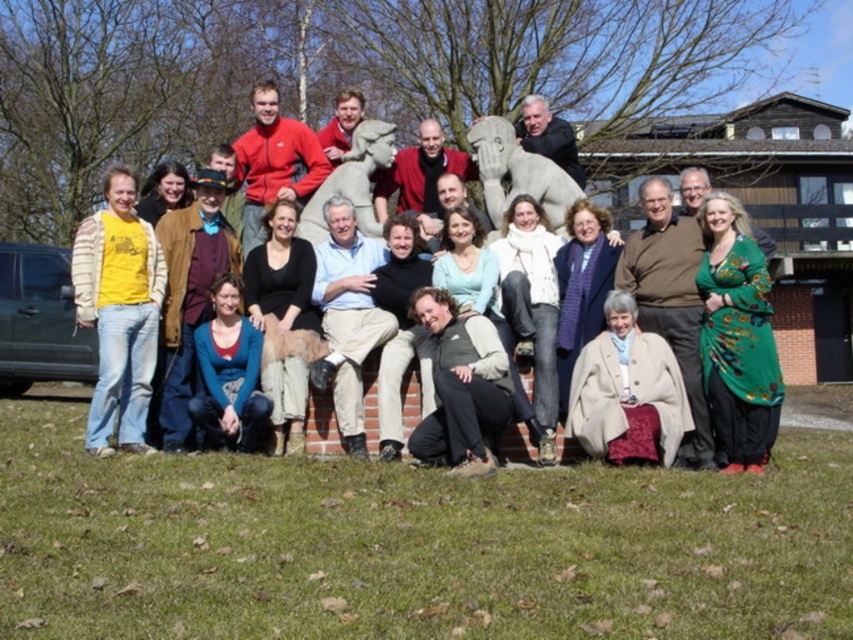
Question: Among these points, which one is nearest to the camera?

Choices:
 (A) (474, 148)
 (B) (741, 256)

Answer: (B)

Question: Does yellow striped sweater at left appear on the left side of matte red jacket at center?

Choices:
 (A) no
 (B) yes

Answer: (B)

Question: Does matte red jacket at center have a greater width compared to stone statue at center?

Choices:
 (A) no
 (B) yes

Answer: (B)

Question: Considering the real-world distances, which object is farthest from the green fuzzy vest at center?

Choices:
 (A) stone statue at center
 (B) matte stone statues at center
 (C) yellow striped sweater at left

Answer: (A)

Question: From the image, what is the correct spatial relationship of green fuzzy vest at center in relation to stone statue at center?

Choices:
 (A) left
 (B) right

Answer: (B)

Question: Among these objects, which one is nearest to the camera?

Choices:
 (A) matte stone statues at center
 (B) green silk dress at lower right
 (C) yellow striped sweater at left
 (D) matte red jacket at center

Answer: (B)